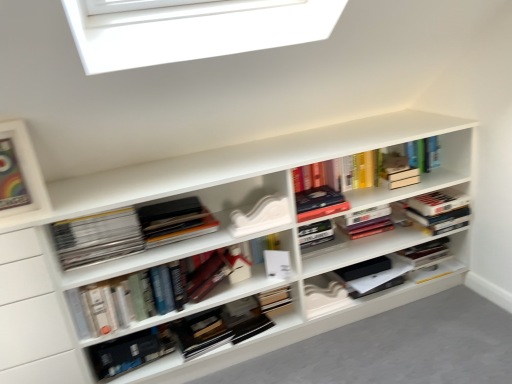
Find the location of `vacant area on top of hardcover book at center, acting as the 2th book starting from the right (from a real-world perspective)`. vacant area on top of hardcover book at center, acting as the 2th book starting from the right (from a real-world perspective) is located at coordinates (309, 184).